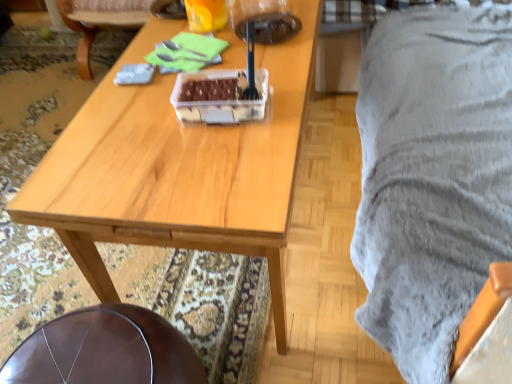
At what (x,y) coordinates should I click in order to perform the action: click on free space to the right of translucent plastic container at center. Please return your answer as a coordinate pair (x, y). The image size is (512, 384). Looking at the image, I should click on (291, 91).